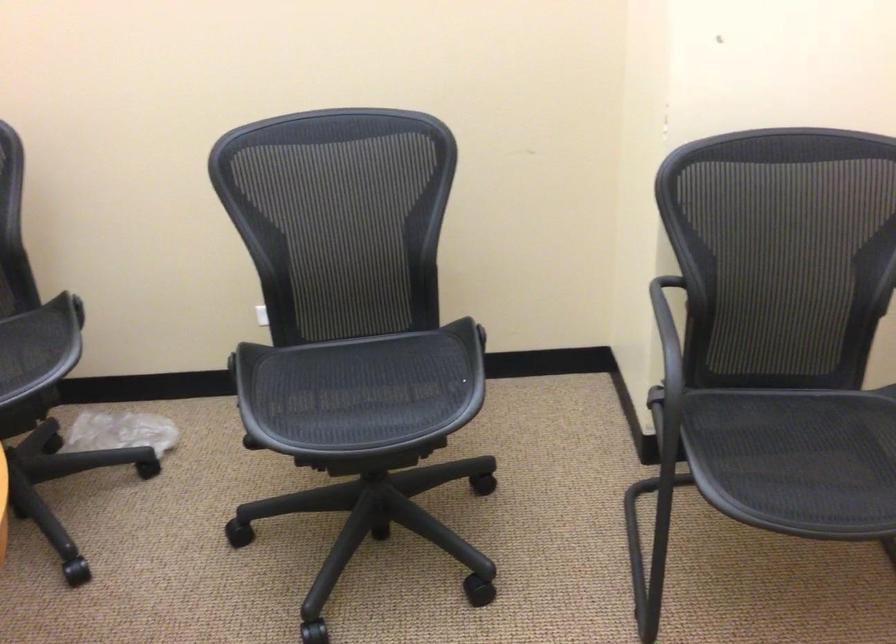
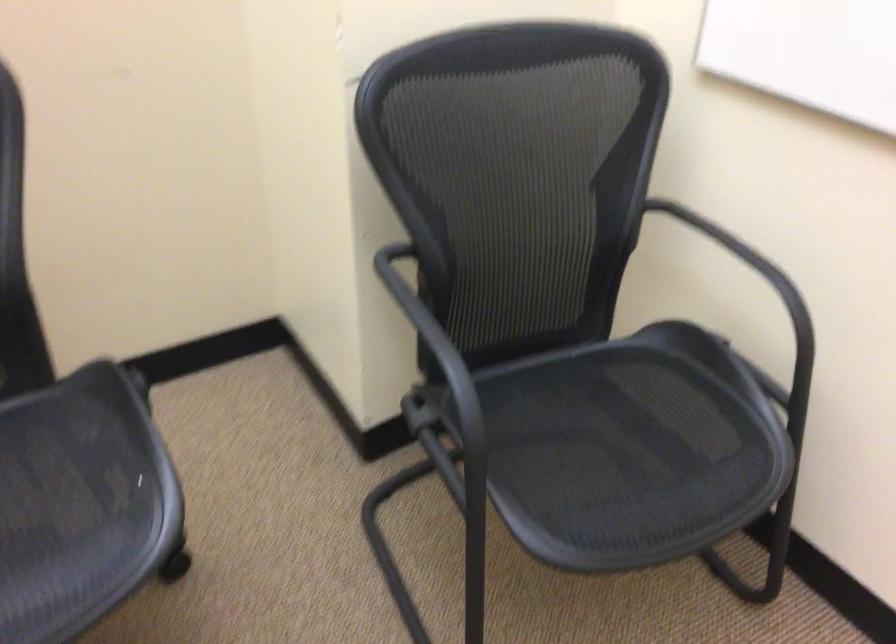
Question: Based on the continuous images, in which direction is the camera rotating? Reply with the corresponding letter.

Choices:
 (A) Left
 (B) Right
 (C) Up
 (D) Down

Answer: (B)